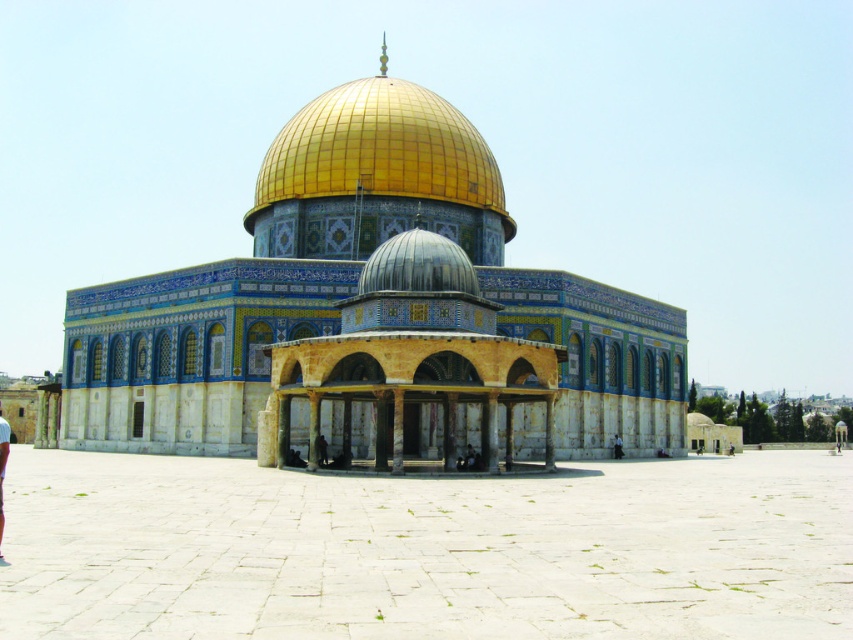
Question: Does gold metallic dome at upper center have a smaller size compared to light blue fabric pants at lower left?

Choices:
 (A) no
 (B) yes

Answer: (B)

Question: Among these objects, which one is farthest from the camera?

Choices:
 (A) gold metallic dome at upper center
 (B) golden mosaic dome at center

Answer: (A)

Question: Does golden mosaic dome at center come behind light blue fabric pants at lower left?

Choices:
 (A) yes
 (B) no

Answer: (A)

Question: Among these points, which one is nearest to the camera?

Choices:
 (A) (486, 436)
 (B) (0, 525)
 (C) (344, 205)

Answer: (B)

Question: Is golden mosaic dome at center bigger than gold metallic dome at upper center?

Choices:
 (A) yes
 (B) no

Answer: (A)

Question: Which object is the closest to the light blue fabric pants at lower left?

Choices:
 (A) golden mosaic dome at center
 (B) gold metallic dome at upper center

Answer: (A)